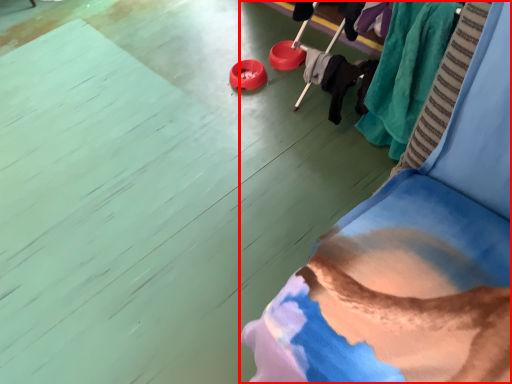
Question: Observing the image, what is the correct spatial positioning of furniture (annotated by the red box) in reference to clothing?

Choices:
 (A) right
 (B) left

Answer: (B)